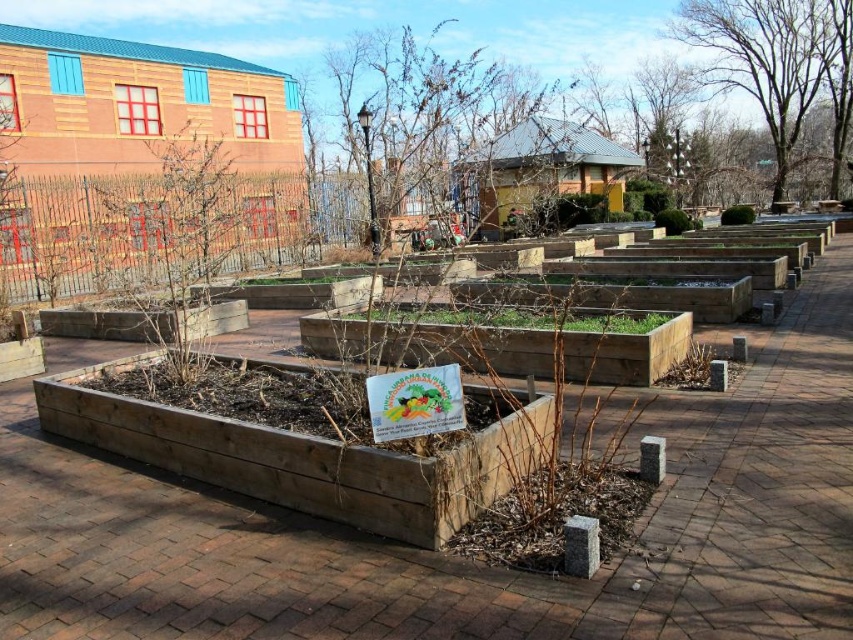
From the picture: You are a gardener who wants to install a new plant marker in the brown wooden flower bed at center. The marker is 1 foot tall. Considering the height of the flower bed and the bare branches at upper right, will the marker be visible from the entrance of the garden?

The brown wooden flower bed at center has a lesser height compared to the bare branches at upper right. Since the flower bed is shorter than the branches, the 1 foot tall marker placed on it would likely be visible from the entrance as it won

You are a visitor looking at the community garden. You see the natural wood planter at center and the bare branches at upper right. Which object is closer to the left side of the image?

The natural wood planter at center is to the left of the bare branches at upper right, so it is closer to the left side of the image.

In the scene shown: You are a gardener looking to water the plants in the brown wooden flower bed at center. You notice there is a hose hanging from the bare branches at upper right. Can you reach the hose from the flower bed?

The brown wooden flower bed at center is below bare branches at upper right, so yes, you can reach the hose hanging from the bare branches at upper right from the flower bed.